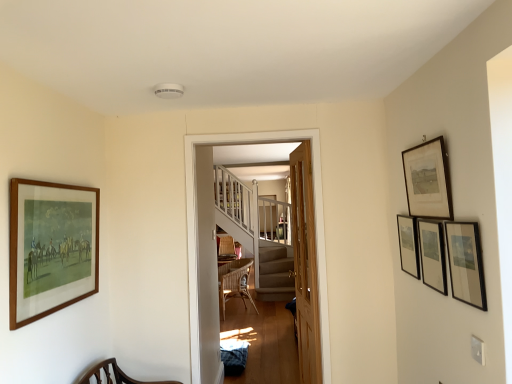
What do you see at coordinates (432, 254) in the screenshot?
I see `black matte picture frame at upper right, acting as the 3th picture frame starting from the right` at bounding box center [432, 254].

Image resolution: width=512 pixels, height=384 pixels. I want to click on wooden framed print at upper right, the 4th picture frame viewed from the right, so click(x=428, y=180).

Where is `woven rattan chair at center`? The image size is (512, 384). woven rattan chair at center is located at coordinates (234, 283).

Identify the location of matte black picture frame at right, positioned as the fourth picture frame in left-to-right order. Image resolution: width=512 pixels, height=384 pixels. pos(466,263).

What do you see at coordinates (51, 247) in the screenshot? I see `wooden-framed painting at left, the 5th picture frame viewed from the right` at bounding box center [51, 247].

You are a GUI agent. You are given a task and a screenshot of the screen. Output one action in this format:
    pyautogui.click(x=<x>, y=<y>)
    Task: Click on the light brown wooden door at center
    The image size is (512, 384).
    Given the screenshot: What is the action you would take?
    pyautogui.click(x=305, y=265)

Identify the location of black matte picture frame at upper right, the 3th picture frame viewed from the left. This screenshot has height=384, width=512. (432, 254).

In order to click on picture frame that is the 2nd one when counting backward from the wooden framed print at upper right, the 4th picture frame viewed from the right in this screenshot , I will do `click(408, 245)`.

Is point (445, 202) positioned after point (407, 224)?

No, it is in front of (407, 224).

Are wooden framed print at upper right, the 4th picture frame viewed from the right, and matte black picture frame at right, which is the 5th picture frame from left to right, far apart?

wooden framed print at upper right, the 4th picture frame viewed from the right, is near matte black picture frame at right, which is the 5th picture frame from left to right, not far away.

Which point is more forward, (302, 315) or (486, 302)?

Positioned in front is point (486, 302).

Which is in front, light brown wooden door at center or matte black picture frame at right, positioned as the fourth picture frame in left-to-right order?

matte black picture frame at right, positioned as the fourth picture frame in left-to-right order, is in front.

From the image's perspective, which one is positioned higher, light brown wooden door at center or matte black picture frame at right, which is the second picture frame from right to left?

matte black picture frame at right, which is the second picture frame from right to left, from the image's perspective.

Is point (422, 229) positioned after point (444, 224)?

Yes, point (422, 229) is farther from viewer.

Who is taller, black matte picture frame at upper right, the 3th picture frame viewed from the left, or matte black picture frame at right, positioned as the fourth picture frame in left-to-right order?

black matte picture frame at upper right, the 3th picture frame viewed from the left.

Is black matte picture frame at upper right, the 3th picture frame viewed from the left, closer to the viewer compared to matte black picture frame at right, positioned as the fourth picture frame in left-to-right order?

No, the depth of black matte picture frame at upper right, the 3th picture frame viewed from the left, is greater than that of matte black picture frame at right, positioned as the fourth picture frame in left-to-right order.

Is matte black picture frame at right, positioned as the fourth picture frame in left-to-right order, far away from wooden-framed painting at left, the 5th picture frame viewed from the right?

That's right, there is a large distance between matte black picture frame at right, positioned as the fourth picture frame in left-to-right order, and wooden-framed painting at left, the 5th picture frame viewed from the right.

Considering the positions of point (462, 226) and point (24, 238), is point (462, 226) closer or farther from the camera than point (24, 238)?

Point (462, 226) is positioned closer to the camera compared to point (24, 238).

From the image's perspective, which object appears higher, matte black picture frame at right, positioned as the fourth picture frame in left-to-right order, or wooden-framed painting at left, which is the first picture frame from left to right?

A: From the image's view, wooden-framed painting at left, which is the first picture frame from left to right, is above.

Can you tell me how much matte black picture frame at right, positioned as the fourth picture frame in left-to-right order, and wooden-framed painting at left, which is the first picture frame from left to right, differ in facing direction?

The angular difference between matte black picture frame at right, positioned as the fourth picture frame in left-to-right order, and wooden-framed painting at left, which is the first picture frame from left to right, is 178 degrees.

Looking at this image, from the image's perspective, between light brown wooden door at center and wooden framed print at upper right, positioned as the 2th picture frame in left-to-right order, who is located below?

light brown wooden door at center appears lower in the image.

Is light brown wooden door at center directly adjacent to wooden framed print at upper right, positioned as the 2th picture frame in left-to-right order?

They are not placed beside each other.

From a real-world perspective, starting from the light brown wooden door at center, which picture frame is the 5th one vertically above it? Please provide its 2D coordinates.

[(428, 180)]

From the image's perspective, between wooden-framed painting at left, the 5th picture frame viewed from the right, and wooden framed print at upper right, positioned as the 2th picture frame in left-to-right order, which one is located above?

From the image's view, wooden framed print at upper right, positioned as the 2th picture frame in left-to-right order, is above.

Considering the positions of point (55, 190) and point (437, 142), is point (55, 190) closer or farther from the camera than point (437, 142)?

Point (55, 190) appears to be farther away from the viewer than point (437, 142).

From a real-world perspective, is wooden-framed painting at left, which is the first picture frame from left to right, located beneath wooden framed print at upper right, positioned as the 2th picture frame in left-to-right order?

Indeed, from a real-world perspective, wooden-framed painting at left, which is the first picture frame from left to right, is positioned beneath wooden framed print at upper right, positioned as the 2th picture frame in left-to-right order.

From the image's perspective, which one is positioned lower, wooden-framed painting at left, which is the first picture frame from left to right, or light brown wooden door at center?

light brown wooden door at center appears lower in the image.

Between wooden-framed painting at left, which is the first picture frame from left to right, and light brown wooden door at center, which one has larger size?

With larger size is light brown wooden door at center.

Considering the relative sizes of wooden-framed painting at left, which is the first picture frame from left to right, and light brown wooden door at center in the image provided, is wooden-framed painting at left, which is the first picture frame from left to right, taller than light brown wooden door at center?

No, wooden-framed painting at left, which is the first picture frame from left to right, is not taller than light brown wooden door at center.

Based on their positions, is wooden-framed painting at left, the 5th picture frame viewed from the right, located to the left or right of light brown wooden door at center?

In the image, wooden-framed painting at left, the 5th picture frame viewed from the right, appears on the left side of light brown wooden door at center.

You are a GUI agent. You are given a task and a screenshot of the screen. Output one action in this format:
    pyautogui.click(x=<x>, y=<y>)
    Task: Click on the 3rd picture frame to the right when counting from the wooden framed print at upper right, the 4th picture frame viewed from the right
    The image size is (512, 384).
    Given the screenshot: What is the action you would take?
    pyautogui.click(x=408, y=245)

In order to click on door below the matte black picture frame at right, which is the second picture frame from right to left (from the image's perspective) in this screenshot , I will do `click(305, 265)`.

When comparing their distances from black matte picture frame at upper right, acting as the 3th picture frame starting from the right, does wooden framed print at upper right, positioned as the 2th picture frame in left-to-right order, or wooden staircase at center seem further?

Based on the image, wooden staircase at center appears to be further to black matte picture frame at upper right, acting as the 3th picture frame starting from the right.

Considering their positions, is wooden framed print at upper right, the 4th picture frame viewed from the right, positioned closer to wooden staircase at center than light brown wooden door at center?

light brown wooden door at center lies closer to wooden staircase at center than the other object.

Consider the image. When comparing their distances from black matte picture frame at upper right, acting as the 3th picture frame starting from the right, does wooden framed print at upper right, positioned as the 2th picture frame in left-to-right order, or light brown wooden door at center seem closer?

wooden framed print at upper right, positioned as the 2th picture frame in left-to-right order.

Based on their spatial positions, is wooden framed print at upper right, positioned as the 2th picture frame in left-to-right order, or wooden-framed painting at left, which is the first picture frame from left to right, closer to black matte picture frame at upper right, acting as the 3th picture frame starting from the right?

Among the two, wooden framed print at upper right, positioned as the 2th picture frame in left-to-right order, is located nearer to black matte picture frame at upper right, acting as the 3th picture frame starting from the right.

When comparing their distances from woven rattan chair at center, does black matte picture frame at upper right, acting as the 3th picture frame starting from the right, or matte black picture frame at right, positioned as the fourth picture frame in left-to-right order, seem closer?

Among the two, black matte picture frame at upper right, acting as the 3th picture frame starting from the right, is located nearer to woven rattan chair at center.

When comparing their distances from wooden framed print at upper right, the 4th picture frame viewed from the right, does matte black picture frame at right, the first picture frame in the right-to-left sequence, or wooden-framed painting at left, the 5th picture frame viewed from the right, seem further?

Among the two, wooden-framed painting at left, the 5th picture frame viewed from the right, is located further to wooden framed print at upper right, the 4th picture frame viewed from the right.

Based on their spatial positions, is matte black picture frame at right, positioned as the fourth picture frame in left-to-right order, or black matte picture frame at upper right, the 3th picture frame viewed from the left, closer to wooden staircase at center?

black matte picture frame at upper right, the 3th picture frame viewed from the left, is closer to wooden staircase at center.

From the image, which object appears to be farther from black matte picture frame at upper right, the 3th picture frame viewed from the left, wooden staircase at center or light brown wooden door at center?

The object further to black matte picture frame at upper right, the 3th picture frame viewed from the left, is light brown wooden door at center.

Locate an element on the screen. This screenshot has height=384, width=512. corridor located between black matte picture frame at upper right, acting as the 3th picture frame starting from the right, and woven rattan chair at center in the depth direction is located at coordinates (198, 236).

Where is `picture frame between black matte picture frame at upper right, the 3th picture frame viewed from the left, and woven rattan chair at center from front to back`? picture frame between black matte picture frame at upper right, the 3th picture frame viewed from the left, and woven rattan chair at center from front to back is located at coordinates (408, 245).

In order to click on picture frame located between black matte picture frame at upper right, acting as the 3th picture frame starting from the right, and light brown wooden door at center in the depth direction in this screenshot , I will do `click(408, 245)`.

You are a GUI agent. You are given a task and a screenshot of the screen. Output one action in this format:
    pyautogui.click(x=<x>, y=<y>)
    Task: Click on the door between wooden staircase at center and matte black picture frame at right, the first picture frame in the right-to-left sequence
    
    Given the screenshot: What is the action you would take?
    pyautogui.click(x=305, y=265)